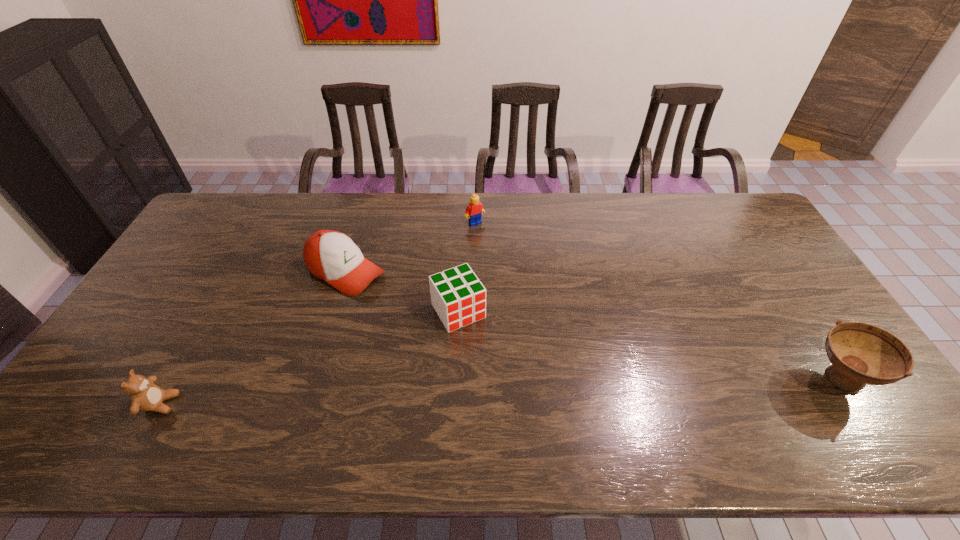
Where is `object that is at the near right corner`? object that is at the near right corner is located at coordinates (860, 353).

I want to click on free location at the far edge, so click(286, 192).

In the image, there is a desktop. Identify the location of free space at the near edge. The image size is (960, 540). (506, 395).

Where is `vacant area at the left edge`? vacant area at the left edge is located at coordinates (181, 294).

You are a GUI agent. You are given a task and a screenshot of the screen. Output one action in this format:
    pyautogui.click(x=<x>, y=<y>)
    Task: Click on the blank space at the right edge
    The width and height of the screenshot is (960, 540).
    Given the screenshot: What is the action you would take?
    pyautogui.click(x=803, y=354)

In the image, there is a desktop. Where is `vacant space at the far left corner`? This screenshot has height=540, width=960. vacant space at the far left corner is located at coordinates (233, 195).

Where is `free location at the far right corner of the desktop`? The width and height of the screenshot is (960, 540). free location at the far right corner of the desktop is located at coordinates [x=736, y=222].

Identify the location of free point between the farthest object and the soup bowl. This screenshot has height=540, width=960. (657, 301).

Where is `free space between the teddy bear and the baseball cap`? The image size is (960, 540). free space between the teddy bear and the baseball cap is located at coordinates (253, 338).

The height and width of the screenshot is (540, 960). I want to click on vacant space that's between the Lego and the second object from left to right, so click(x=410, y=248).